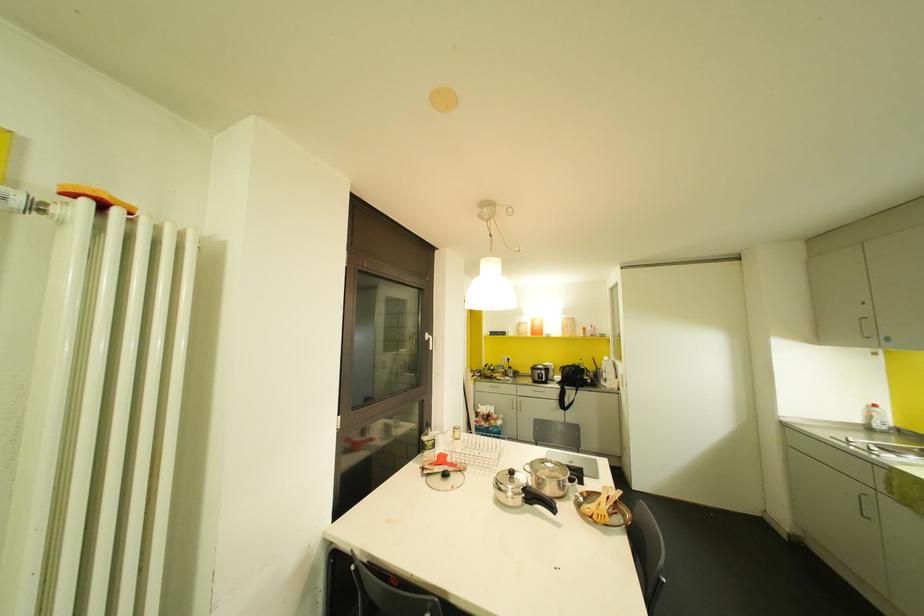
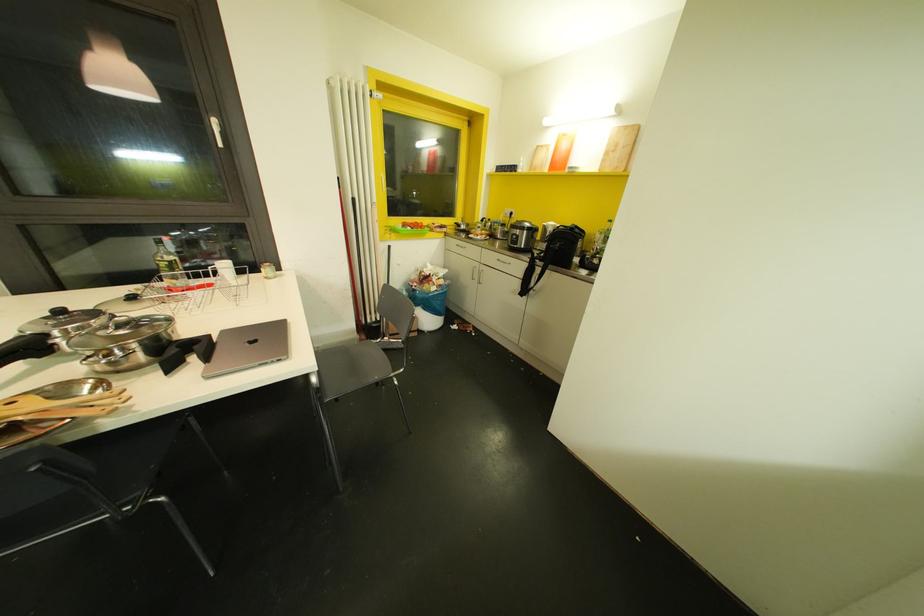
In the second image, find the point that corresponds to [484,385] in the first image.

(453, 243)